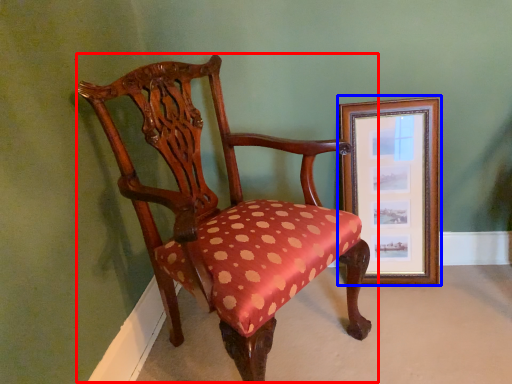
Question: Which point is further to the camera, chair (highlighted by a red box) or picture frame (highlighted by a blue box)?

Choices:
 (A) chair
 (B) picture frame

Answer: (B)